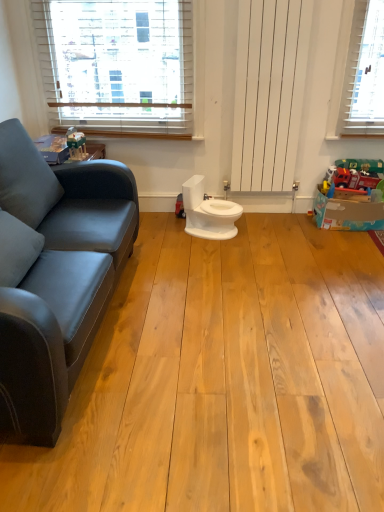
Question: Is there a large distance between matte plastic toy at upper left, which is counted as the 2th toy, starting from the back, and white wooden blinds at upper left?

Choices:
 (A) no
 (B) yes

Answer: (A)

Question: Can you confirm if matte plastic toy at upper left, arranged as the first toy when viewed from the front, is smaller than white wooden blinds at upper left?

Choices:
 (A) no
 (B) yes

Answer: (B)

Question: From the image's perspective, would you say matte plastic toy at upper left, which is counted as the 1th toy, starting from the left, is positioned over white wooden blinds at upper left?

Choices:
 (A) no
 (B) yes

Answer: (A)

Question: From a real-world perspective, is matte plastic toy at upper left, arranged as the first toy when viewed from the front, located higher than white wooden blinds at upper left?

Choices:
 (A) yes
 (B) no

Answer: (B)

Question: From a real-world perspective, does matte plastic toy at upper left, which is counted as the 2th toy, starting from the back, sit lower than white wooden blinds at upper left?

Choices:
 (A) yes
 (B) no

Answer: (A)

Question: Based on their positions, is matte plastic toy at upper left, which is counted as the 2th toy, starting from the back, located to the left or right of white wooden blinds at upper left?

Choices:
 (A) right
 (B) left

Answer: (B)

Question: Is matte plastic toy at upper left, which is counted as the 1th toy, starting from the left, inside the boundaries of white wooden blinds at upper left, or outside?

Choices:
 (A) inside
 (B) outside

Answer: (B)

Question: Is matte plastic toy at upper left, which appears as the 2th toy when viewed from the right, taller or shorter than white wooden blinds at upper left?

Choices:
 (A) tall
 (B) short

Answer: (B)

Question: From a real-world perspective, is matte plastic toy at upper left, arranged as the first toy when viewed from the front, physically located above or below white wooden blinds at upper left?

Choices:
 (A) above
 (B) below

Answer: (B)

Question: In the image, is matte red fire truck at right, arranged as the 1th toy when viewed from the right, positioned in front of or behind white glossy toilet at center?

Choices:
 (A) front
 (B) behind

Answer: (B)

Question: Is matte red fire truck at right, arranged as the 1th toy when viewed from the right, situated inside white glossy toilet at center or outside?

Choices:
 (A) outside
 (B) inside

Answer: (A)

Question: Considering the positions of matte red fire truck at right, acting as the second toy starting from the left, and white glossy toilet at center in the image, is matte red fire truck at right, acting as the second toy starting from the left, wider or thinner than white glossy toilet at center?

Choices:
 (A) wide
 (B) thin

Answer: (B)

Question: In terms of size, does matte red fire truck at right, arranged as the 1th toy when viewed from the right, appear bigger or smaller than white glossy toilet at center?

Choices:
 (A) big
 (B) small

Answer: (A)

Question: Based on their positions, is white glossy toilet at center located to the left or right of white wooden blinds at upper left?

Choices:
 (A) right
 (B) left

Answer: (A)

Question: Is point (223, 202) positioned closer to the camera than point (180, 76)?

Choices:
 (A) closer
 (B) farther

Answer: (B)